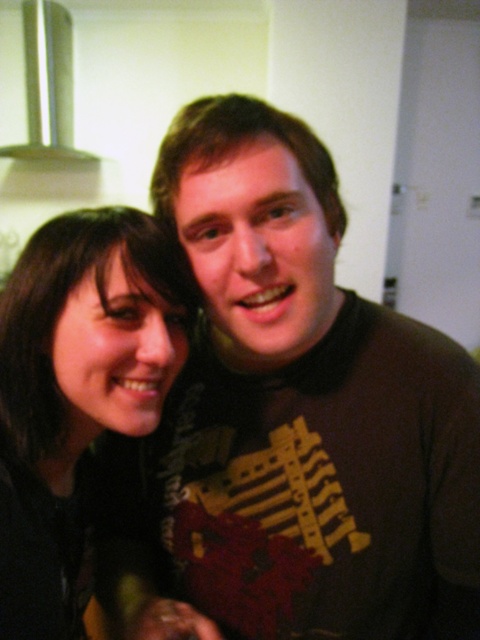
Is dark brown t-shirt at center taller than black matte hair at left?

Yes, dark brown t-shirt at center is taller than black matte hair at left.

At what (x,y) coordinates should I click in order to perform the action: click on dark brown t-shirt at center. Please return your answer as a coordinate pair (x, y). The image size is (480, 640). Looking at the image, I should click on (304, 406).

Is point (249, 250) less distant than point (171, 344)?

Yes, it is in front of point (171, 344).

In order to click on dark brown t-shirt at center in this screenshot , I will do `click(304, 406)`.

Can you confirm if dark brown t-shirt at center is thinner than silver metallic exhaust hood at upper left?

In fact, dark brown t-shirt at center might be wider than silver metallic exhaust hood at upper left.

Does point (268, 401) come in front of point (68, 113)?

Yes, it is in front of point (68, 113).

Locate an element on the screen. dark brown t-shirt at center is located at coordinates point(304,406).

Between point (54, 442) and point (64, 147), which one is positioned behind?

Point (64, 147)

What do you see at coordinates (76, 394) in the screenshot?
I see `black matte hair at left` at bounding box center [76, 394].

Locate an element on the screen. black matte hair at left is located at coordinates (76, 394).